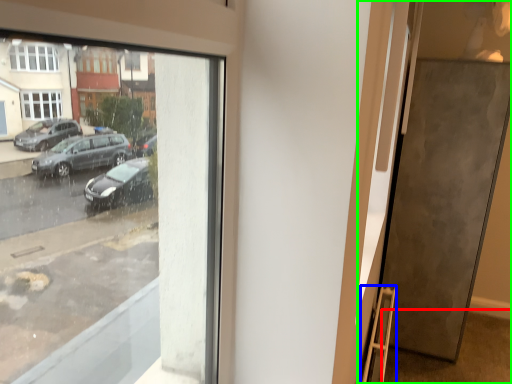
Question: Which object is the farthest from pavement (highlighted by a red box)? Choose among these: ladder (highlighted by a blue box) or door (highlighted by a green box).

Choices:
 (A) ladder
 (B) door

Answer: (A)